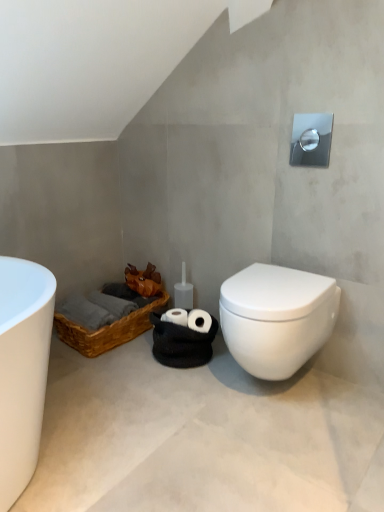
Question: From a real-world perspective, is white glossy toilet at lower right above or below white matte concrete at lower center?

Choices:
 (A) above
 (B) below

Answer: (A)

Question: Do you think white glossy toilet at lower right is within white matte concrete at lower center, or outside of it?

Choices:
 (A) outside
 (B) inside

Answer: (A)

Question: Which object is positioned farthest from the brown woven basket at lower left?

Choices:
 (A) white matte concrete at lower center
 (B) white glossy toilet at lower right

Answer: (B)

Question: Which object is the closest to the white glossy toilet at lower right?

Choices:
 (A) white matte concrete at lower center
 (B) brown woven basket at lower left

Answer: (A)